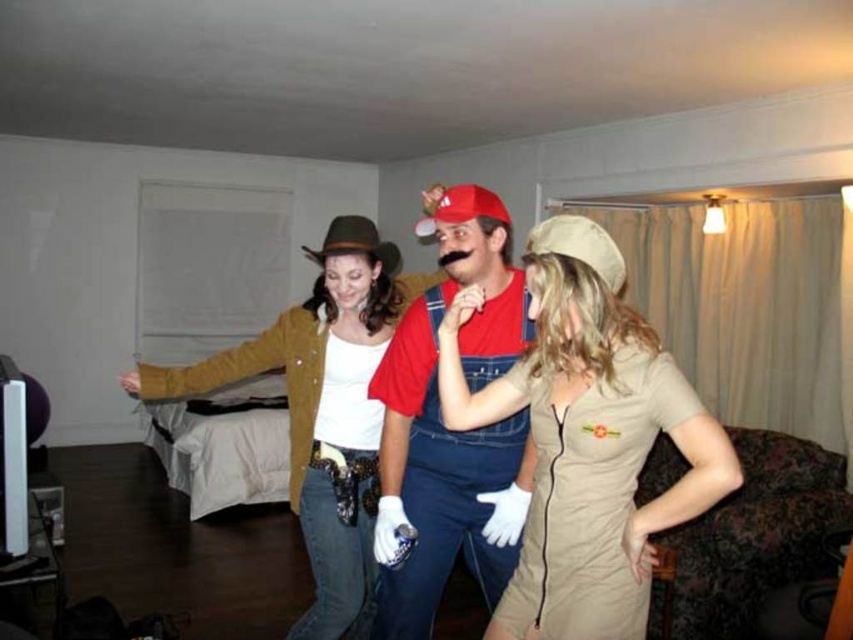
Image resolution: width=853 pixels, height=640 pixels. Describe the element at coordinates (587, 440) in the screenshot. I see `tan fabric dress at center` at that location.

Does tan fabric dress at center have a lesser width compared to red cotton overalls at center?

→ Correct, tan fabric dress at center's width is less than red cotton overalls at center's.

At what (x,y) coordinates should I click in order to perform the action: click on tan fabric dress at center. Please return your answer as a coordinate pair (x, y). This screenshot has height=640, width=853. Looking at the image, I should click on (587, 440).

Where is `tan fabric dress at center`? The height and width of the screenshot is (640, 853). tan fabric dress at center is located at coordinates (587, 440).

Find the location of a particular element. The height and width of the screenshot is (640, 853). red cotton overalls at center is located at coordinates (479, 273).

Who is more distant from viewer, [524,316] or [310,508]?

The point [310,508] is behind.

Locate an element on the screen. The image size is (853, 640). red cotton overalls at center is located at coordinates (479, 273).

Which is behind, point (462, 536) or point (360, 300)?

Point (360, 300)

This screenshot has height=640, width=853. I want to click on matte red shirt at center, so click(x=450, y=429).